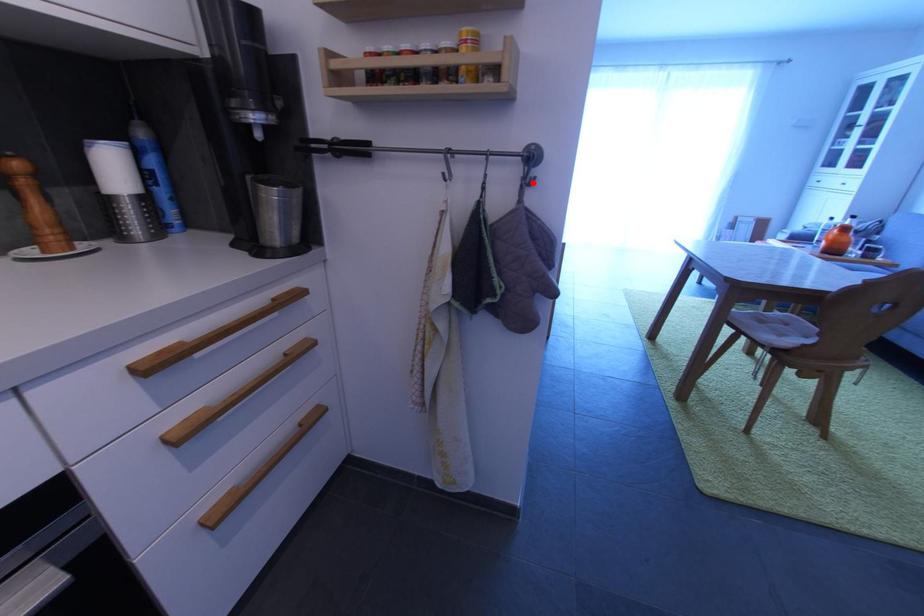
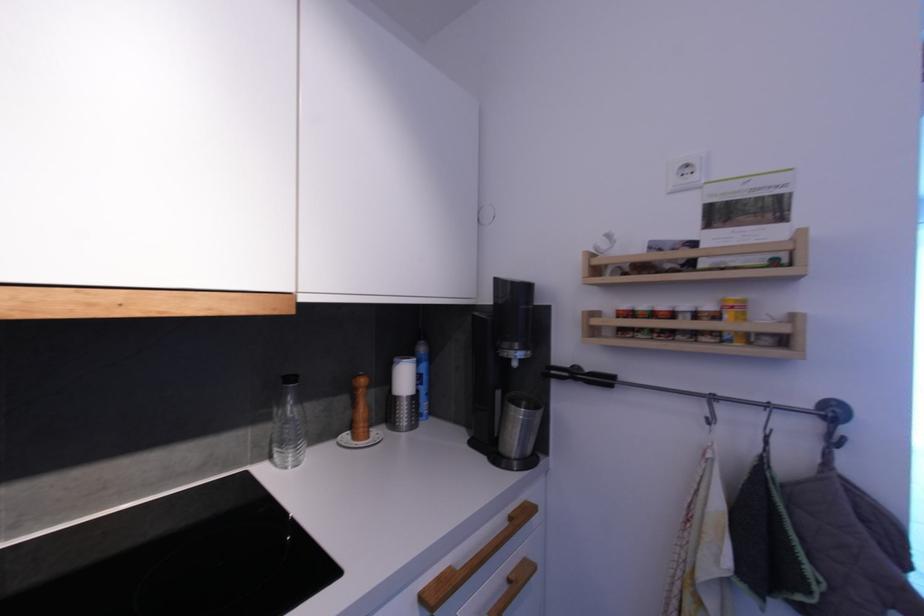
Question: I am providing you with two images of the same scene from different viewpoints. Given a red point in image1, look at the same physical point in image2. Is it:

Choices:
 (A) Closer to the viewpoint
 (B) Farther from the viewpoint

Answer: (A)